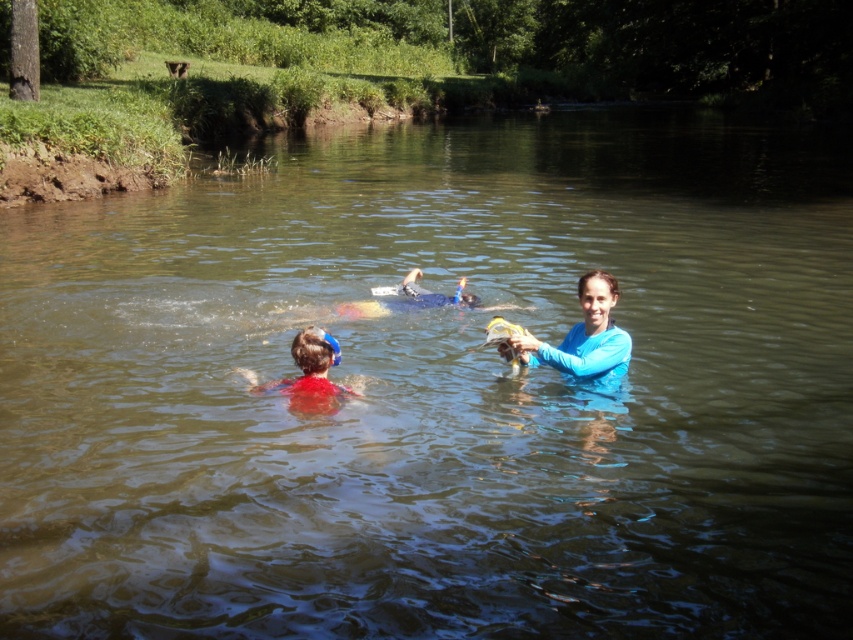
Question: Which object is the farthest from the matte red swim cap at center?

Choices:
 (A) blue matte shirt at center
 (B) blue rubber snorkel at center

Answer: (B)

Question: Can you confirm if blue matte shirt at center is wider than blue rubber snorkel at center?

Choices:
 (A) yes
 (B) no

Answer: (B)

Question: Which object is positioned closest to the matte red swim cap at center?

Choices:
 (A) blue rubber snorkel at center
 (B) blue matte shirt at center

Answer: (B)

Question: Does blue matte shirt at center appear under blue rubber snorkel at center?

Choices:
 (A) no
 (B) yes

Answer: (B)

Question: Is blue matte shirt at center wider than blue rubber snorkel at center?

Choices:
 (A) yes
 (B) no

Answer: (B)

Question: Which point appears farthest from the camera in this image?

Choices:
 (A) (309, 390)
 (B) (556, 364)

Answer: (A)